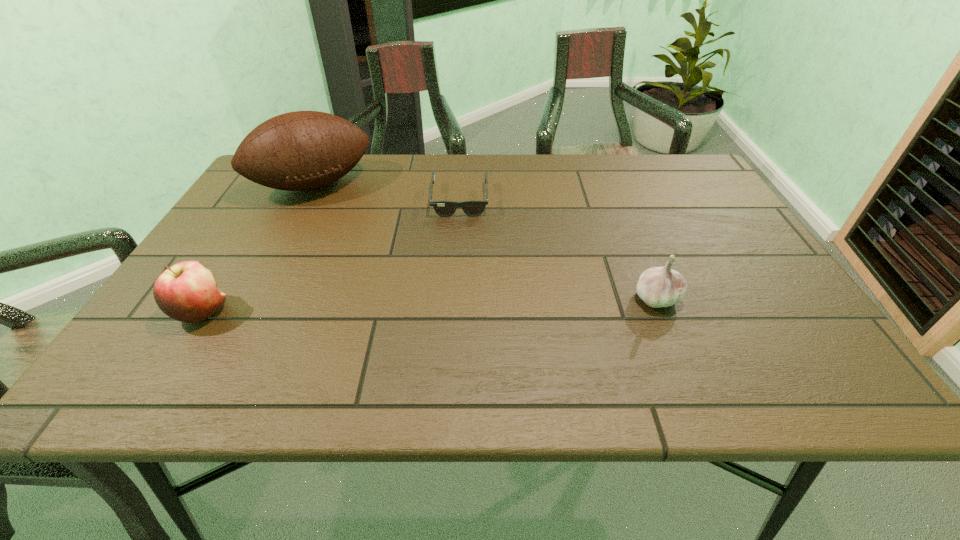
Locate an element on the screen. The width and height of the screenshot is (960, 540). apple is located at coordinates (187, 292).

Where is `the rightmost object`? the rightmost object is located at coordinates (661, 286).

In order to click on sunglasses in this screenshot , I will do click(473, 207).

The height and width of the screenshot is (540, 960). What are the coordinates of `the shortest object` in the screenshot? It's located at (473, 207).

I want to click on the tallest object, so click(x=302, y=150).

The height and width of the screenshot is (540, 960). I want to click on free spot located on the right of the apple, so click(275, 312).

Where is `vacant region located 0.090m on the left of the rightmost object`? This screenshot has width=960, height=540. vacant region located 0.090m on the left of the rightmost object is located at coordinates (590, 298).

This screenshot has height=540, width=960. Find the location of `vacant point located on the temples of the third object from left to right`. vacant point located on the temples of the third object from left to right is located at coordinates (456, 299).

This screenshot has height=540, width=960. I want to click on vacant space located on the temples of the third object from left to right, so click(x=455, y=340).

You are a GUI agent. You are given a task and a screenshot of the screen. Output one action in this format:
    pyautogui.click(x=<x>, y=<y>)
    Task: Click on the vacant space positioned on the temples of the third object from left to right
    The image size is (960, 540).
    Given the screenshot: What is the action you would take?
    pyautogui.click(x=458, y=235)